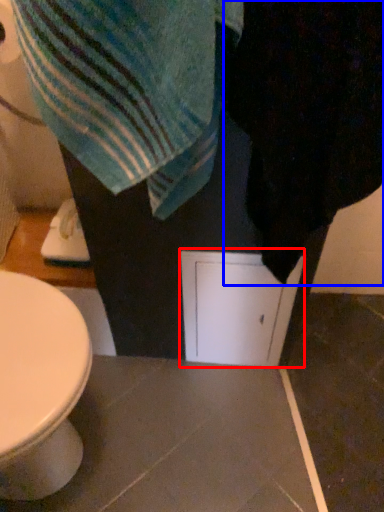
Question: Which of the following is the farthest to the observer, screen door (highlighted by a red box) or bath towel (highlighted by a blue box)?

Choices:
 (A) screen door
 (B) bath towel

Answer: (A)